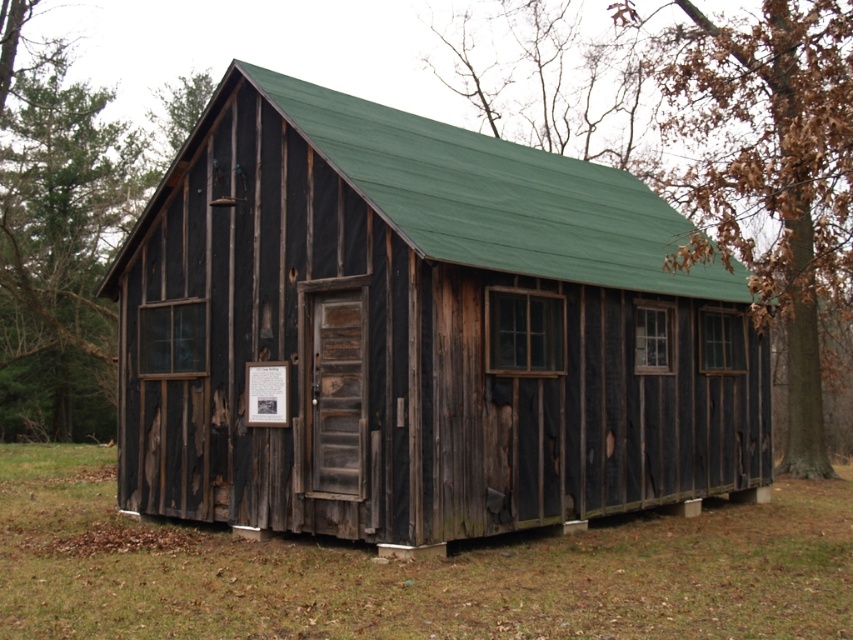
Question: In this image, where is black weathered wood cabin at center located relative to brown leafy tree at right?

Choices:
 (A) above
 (B) below

Answer: (B)

Question: Among these points, which one is nearest to the camera?

Choices:
 (A) (637, 294)
 (B) (90, 392)
 (C) (810, 154)

Answer: (C)

Question: Does black weathered wood cabin at center have a greater width compared to brown leafy tree at right?

Choices:
 (A) no
 (B) yes

Answer: (B)

Question: Which point appears farthest from the camera in this image?

Choices:
 (A) (256, 67)
 (B) (814, 173)

Answer: (A)

Question: Which point is closer to the camera?

Choices:
 (A) brown leafy tree at right
 (B) black weathered wood cabin at center
 (C) green rough bark tree at upper left

Answer: (A)

Question: Considering the relative positions of black weathered wood cabin at center and green rough bark tree at upper left in the image provided, where is black weathered wood cabin at center located with respect to green rough bark tree at upper left?

Choices:
 (A) right
 (B) left

Answer: (A)